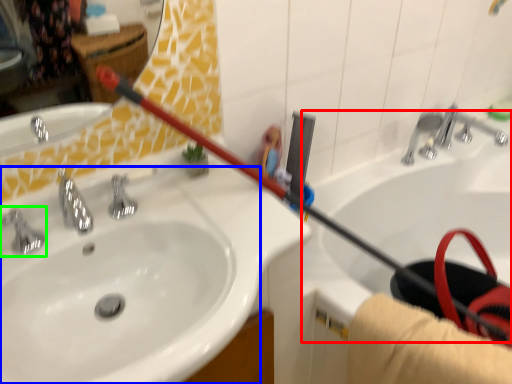
Question: Which is farther away from bath (highlighted by a red box)? sink (highlighted by a blue box) or tap (highlighted by a green box)?

Choices:
 (A) sink
 (B) tap

Answer: (B)